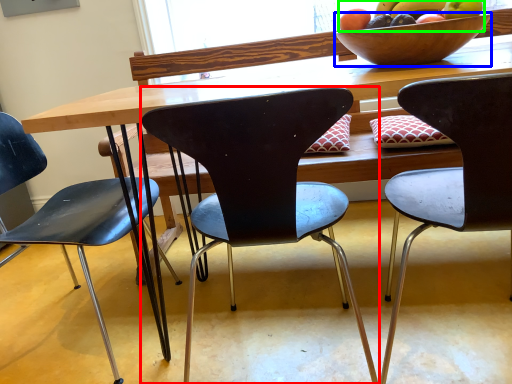
Question: Estimate the real-world distances between objects in this image. Which object is closer to chair (highlighted by a red box), bowl (highlighted by a blue box) or grapefruit (highlighted by a green box)?

Choices:
 (A) bowl
 (B) grapefruit

Answer: (A)